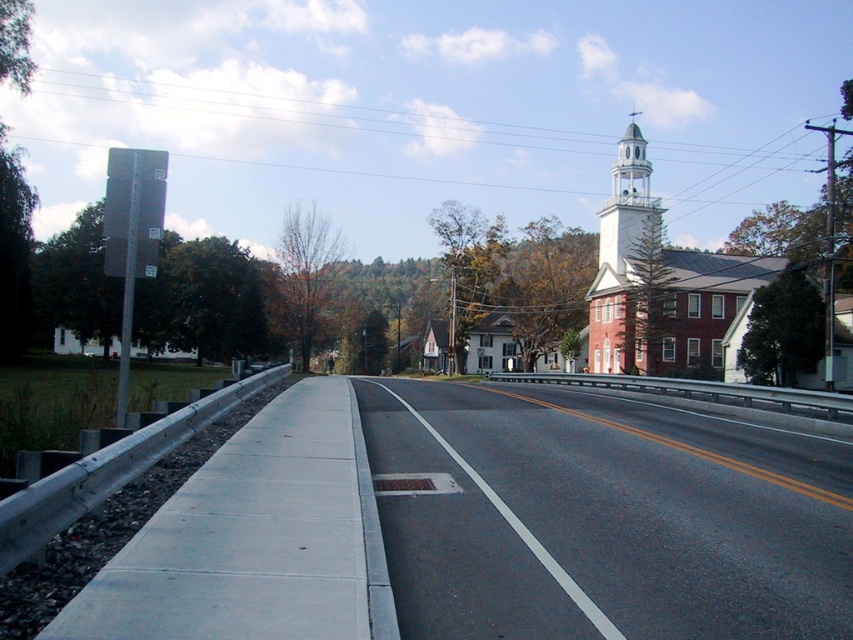
You are a delivery driver planning to take a photo of the white stucco bell tower at upper right from the asphalt road at center. Considering their sizes, which object would appear larger in your camera view?

The white stucco bell tower at upper right would appear larger in the camera view because it is larger in size compared to the asphalt road at center.

You are standing at the point with coordinates point (653, 209) and want to walk to the point with coordinates point (648, 570). Which direction should you face to walk directly towards your destination?

You should face forward because point (648, 570) is in front of point (653, 209).

You are a pedestrian standing on the sidewalk on the left side of the asphalt road at center. You want to walk towards the white stucco bell tower at upper right. Which direction should you turn to face the bell tower?

The asphalt road at center is to the left of the white stucco bell tower at upper right. Since you are on the sidewalk on the left side of the road, you should turn to your right to face the bell tower.